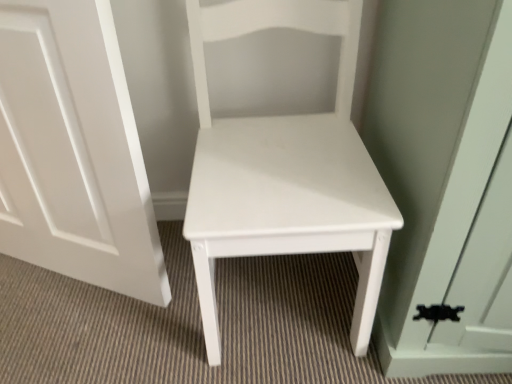
Question: Are white matte door at center and white matte chair at center far apart?

Choices:
 (A) yes
 (B) no

Answer: (B)

Question: Is white matte door at center positioned with its back to white matte chair at center?

Choices:
 (A) yes
 (B) no

Answer: (B)

Question: Is white matte door at center closer to camera compared to white matte chair at center?

Choices:
 (A) no
 (B) yes

Answer: (A)

Question: Does white matte door at center have a smaller size compared to white matte chair at center?

Choices:
 (A) no
 (B) yes

Answer: (B)

Question: Is white matte door at center at the left side of white matte chair at center?

Choices:
 (A) yes
 (B) no

Answer: (A)

Question: Is white matte door at center directly adjacent to white matte chair at center?

Choices:
 (A) no
 (B) yes

Answer: (A)

Question: From a real-world perspective, is white matte chair at center located higher than white matte door at center?

Choices:
 (A) no
 (B) yes

Answer: (B)

Question: Does white matte chair at center touch white matte door at center?

Choices:
 (A) yes
 (B) no

Answer: (B)

Question: From the image's perspective, is white matte chair at center below white matte door at center?

Choices:
 (A) no
 (B) yes

Answer: (B)

Question: Can you confirm if white matte chair at center is bigger than white matte door at center?

Choices:
 (A) yes
 (B) no

Answer: (A)

Question: Is white matte chair at center shorter than white matte door at center?

Choices:
 (A) yes
 (B) no

Answer: (B)

Question: Is white matte door at center located within white matte chair at center?

Choices:
 (A) no
 (B) yes

Answer: (A)

Question: Considering the positions of white matte chair at center and white matte door at center in the image, is white matte chair at center taller or shorter than white matte door at center?

Choices:
 (A) short
 (B) tall

Answer: (B)